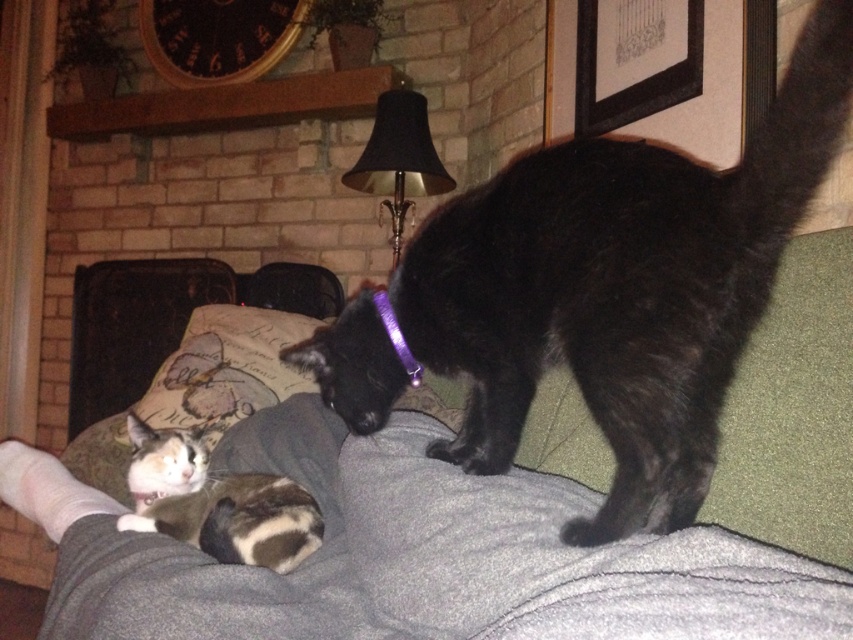
You are standing in front of the couch where the black cat with a purple collar is. You want to reach the point at coordinates (633, 520). If your arm can extend 30 inches, can you reach that point?

The point at coordinates (633, 520) is 31.34 inches away from you, which is slightly beyond your arm reach of 30 inches. You cannot reach it with your arm.

You are a photographer standing 1.5 meters away from the couch. You want to take a photo of the black cat wearing a purple collar on the armrest. There is a point at coordinates point (67,541) that is 1.34 meters away from the camera. Is this point likely part of the black cat or the calico cat?

The point at coordinates point (67,541) is 1.34 meters away from the camera. Since the photographer is standing 1.5 meters away from the couch, this point is closer to the camera than the couch. Therefore, it is likely part of the black cat wearing a purple collar on the armrest, as it is positioned closer to the camera compared to the calico cat lying further back.

You are a cat owner who wants to place a small toy between the black fur cat at upper right and the green fabric couch at upper center. Where should you place it to ensure it is between them?

The black fur cat at upper right is positioned on the right side of green fabric couch at upper center, so placing the toy to the left of the black fur cat at upper right and to the right of the green fabric couch at upper center would place it between them.